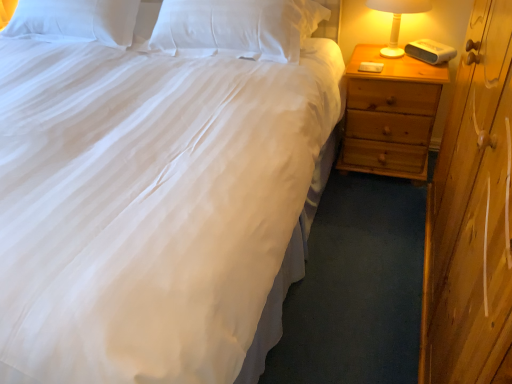
Identify the location of free region under white plastic lamp at right (from a real-world perspective). (389, 52).